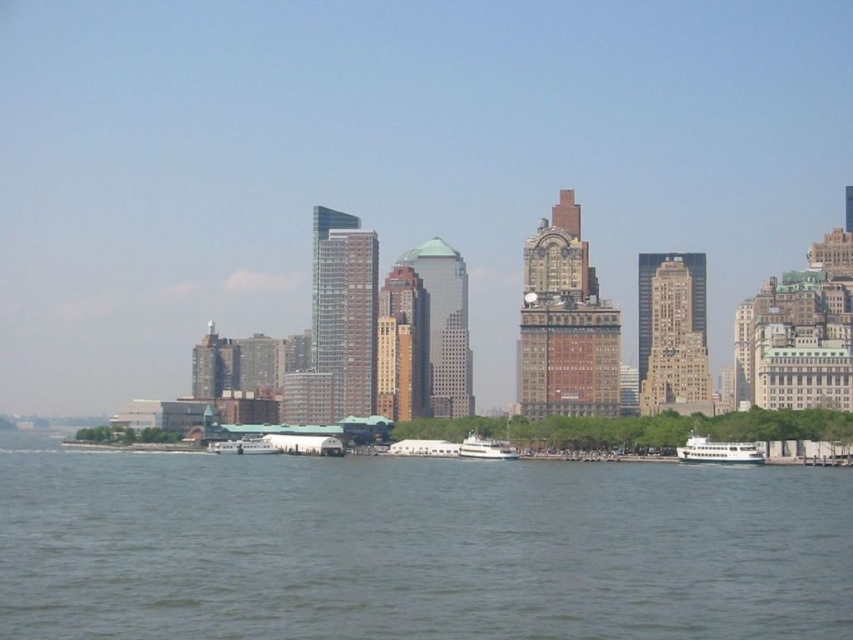
You are standing at the center of the dock and want to locate the white glossy ferry at lower right. According to the coordinates provided, in which direction should you look to find it?

The white glossy ferry at lower right is located at coordinates point (x=718, y=451), so you should look to your lower right direction to find it.

You are standing on the dock and see two points in the scene. The first point is at coordinates point (39,618) and the second is at point (743,444). Which point is closer to you?

Point (39,618) is closer to you because it is further to the camera than point (743,444).

You are standing on the dock and see a point marked at coordinates (x=718, y=451). Which object does this point belong to?

The point at coordinates (x=718, y=451) belongs to the white glossy ferry at lower right.